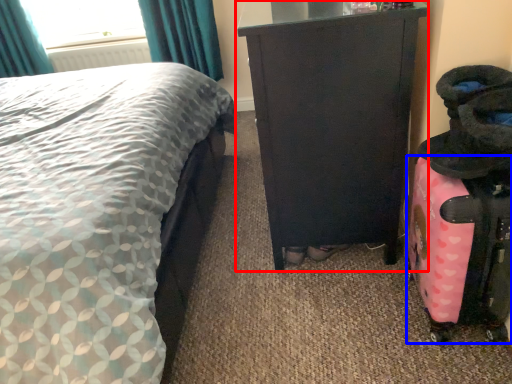
Question: Which object is closer to the camera taking this photo, furniture (highlighted by a red box) or luggage (highlighted by a blue box)?

Choices:
 (A) furniture
 (B) luggage

Answer: (B)